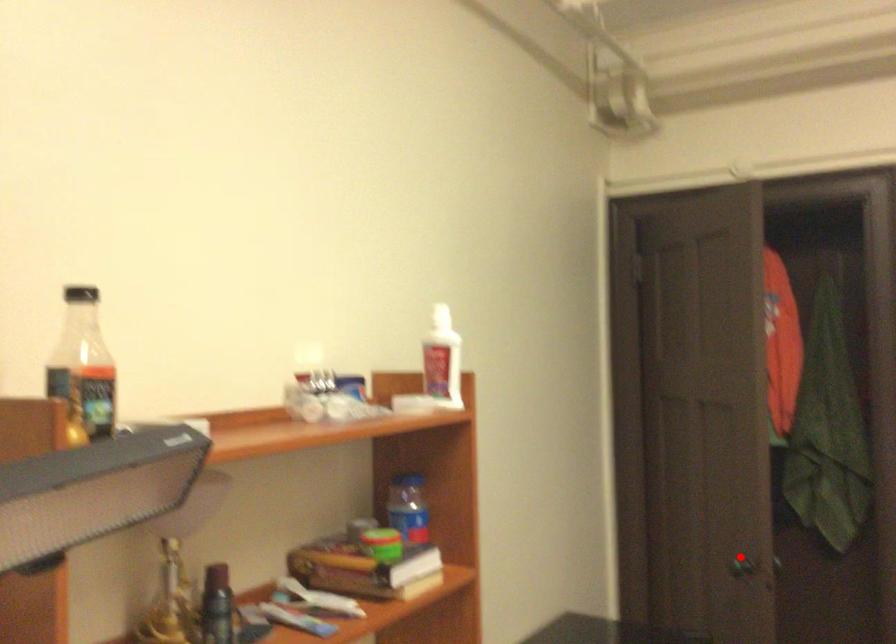
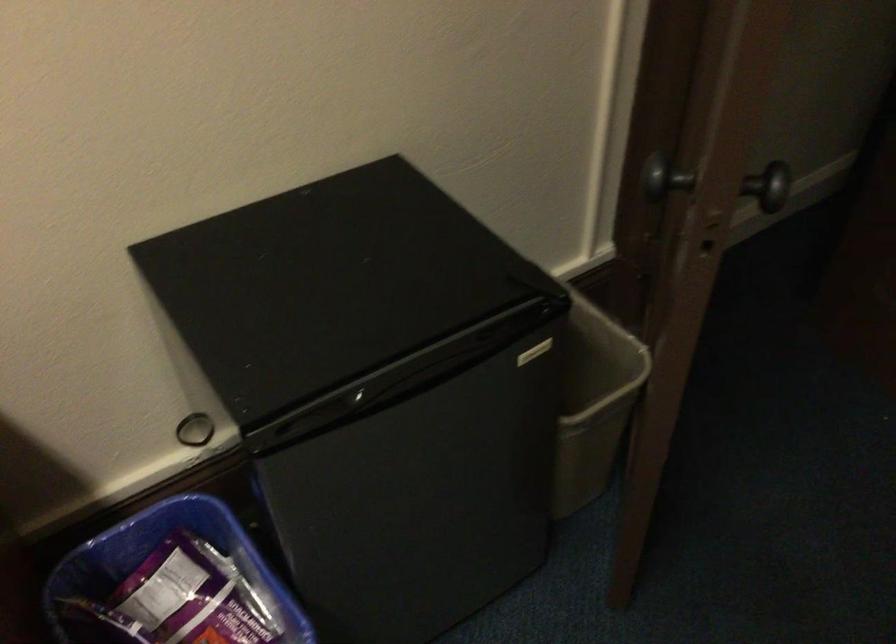
Find the pixel in the second image that matches the highlighted location in the first image.

(656, 174)